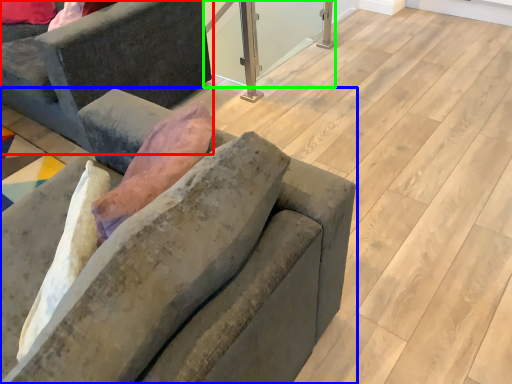
Question: Which is nearer to the studio couch (highlighted by a red box)? studio couch (highlighted by a blue box) or window screen (highlighted by a green box).

Choices:
 (A) studio couch
 (B) window screen

Answer: (A)